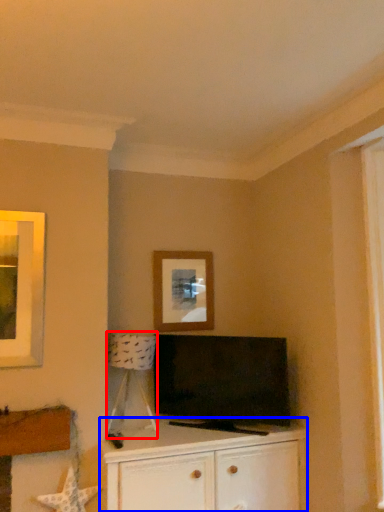
Question: Among these objects, which one is nearest to the camera, lamp (highlighted by a red box) or cabinetry (highlighted by a blue box)?

Choices:
 (A) lamp
 (B) cabinetry

Answer: (B)